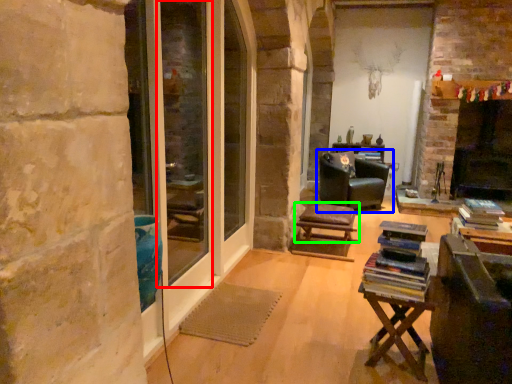
Question: Which object is the closest to the screen door (highlighted by a red box)? Choose among these: chair (highlighted by a blue box) or stool (highlighted by a green box).

Choices:
 (A) chair
 (B) stool

Answer: (B)